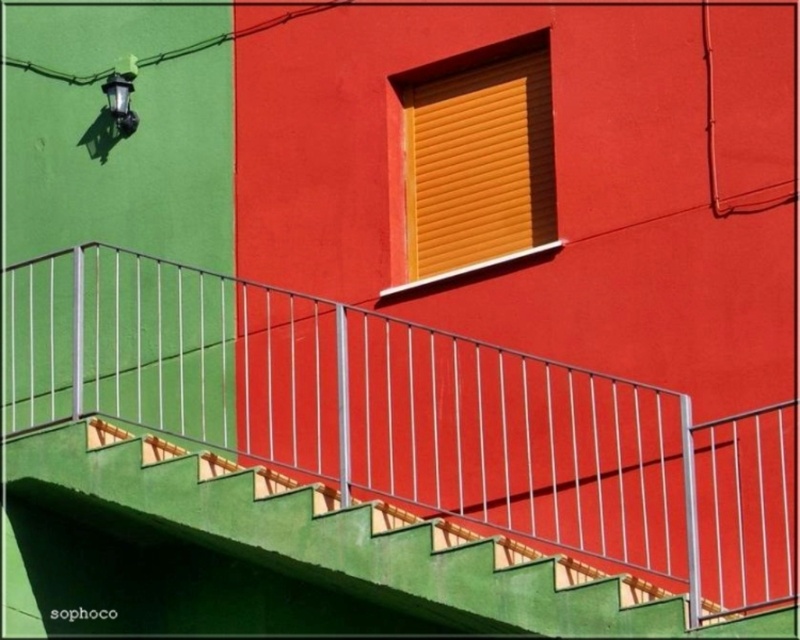
You are standing at the base of the staircase and want to reach the orange matte shutter at upper center and the metallic black lamp at upper left. Which object will you encounter first as you move upward?

You will encounter the orange matte shutter at upper center first because it is closer to the viewer than the metallic black lamp at upper left.

You are an architect designing a new building and need to ensure safety standards are met. According to regulations, the distance between the metallic silver railing at center and the orange matte shutter at upper center must be at least 6 meters to prevent accidental falls. Based on the image provided, is the current distance compliant with the safety standards?

The metallic silver railing at center is 5.54 meters from the orange matte shutter at upper center, which is less than the required 6 meters. Therefore, the current distance does not comply with the safety standards.

You are standing in front of the vibrant red wall with the yellow shuttered window. There are two points marked in the scene. The first point is at coordinate point (540,56) and the second is at point (112,108). Which of these points is closer to you?

Point (540,56) is closer to the camera than point (112,108).